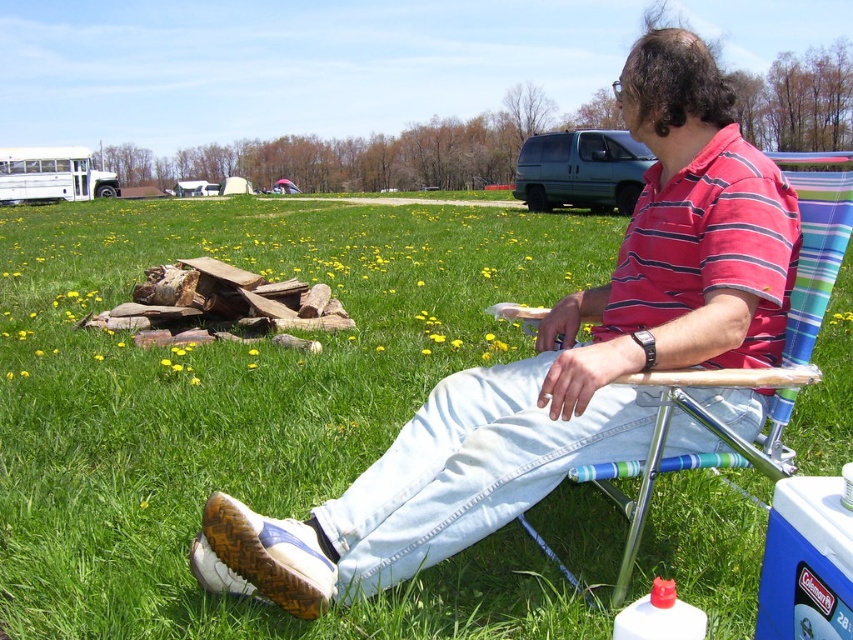
Question: Does striped cotton shirt at center have a lesser width compared to striped fabric chair at right?

Choices:
 (A) no
 (B) yes

Answer: (A)

Question: Which point is closer to the camera?

Choices:
 (A) (825, 212)
 (B) (595, 371)

Answer: (B)

Question: Is the position of striped cotton shirt at center more distant than that of striped fabric chair at right?

Choices:
 (A) no
 (B) yes

Answer: (B)

Question: Is striped cotton shirt at center behind striped fabric chair at right?

Choices:
 (A) yes
 (B) no

Answer: (A)